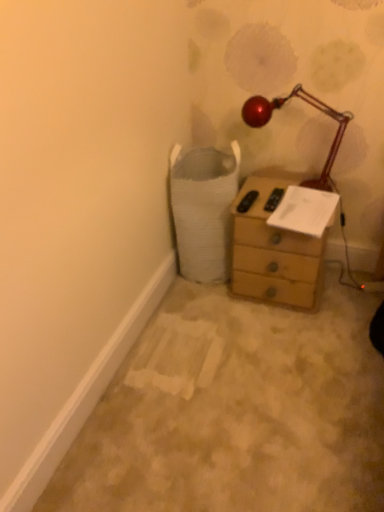
Question: Is wooden chest of drawers at center facing away from white paper at upper right?

Choices:
 (A) yes
 (B) no

Answer: (B)

Question: From a real-world perspective, is wooden chest of drawers at center under white paper at upper right?

Choices:
 (A) yes
 (B) no

Answer: (A)

Question: Can you confirm if wooden chest of drawers at center is positioned to the left of white paper at upper right?

Choices:
 (A) no
 (B) yes

Answer: (B)

Question: Would you say wooden chest of drawers at center contains white paper at upper right?

Choices:
 (A) no
 (B) yes

Answer: (B)

Question: Is wooden chest of drawers at center to the right of white paper at upper right from the viewer's perspective?

Choices:
 (A) yes
 (B) no

Answer: (B)

Question: From a real-world perspective, is white paper at upper right positioned above or below wooden chest of drawers at center?

Choices:
 (A) above
 (B) below

Answer: (A)

Question: Considering the positions of white paper at upper right and wooden chest of drawers at center in the image, is white paper at upper right taller or shorter than wooden chest of drawers at center?

Choices:
 (A) short
 (B) tall

Answer: (A)

Question: From the image's perspective, is white paper at upper right located above or below wooden chest of drawers at center?

Choices:
 (A) above
 (B) below

Answer: (A)

Question: Choose the correct answer: Is white paper at upper right inside wooden chest of drawers at center or outside it?

Choices:
 (A) outside
 (B) inside

Answer: (B)

Question: Is metallic red lamp at upper right bigger or smaller than white paper at upper right?

Choices:
 (A) big
 (B) small

Answer: (A)

Question: Relative to white paper at upper right, is metallic red lamp at upper right in front or behind?

Choices:
 (A) front
 (B) behind

Answer: (A)

Question: Which is correct: metallic red lamp at upper right is inside white paper at upper right, or outside of it?

Choices:
 (A) outside
 (B) inside

Answer: (A)

Question: From the image's perspective, is metallic red lamp at upper right above or below white paper at upper right?

Choices:
 (A) above
 (B) below

Answer: (A)

Question: From a real-world perspective, is wooden chest of drawers at center above or below metallic red lamp at upper right?

Choices:
 (A) above
 (B) below

Answer: (B)

Question: Does point (284, 278) appear closer or farther from the camera than point (261, 114)?

Choices:
 (A) farther
 (B) closer

Answer: (A)